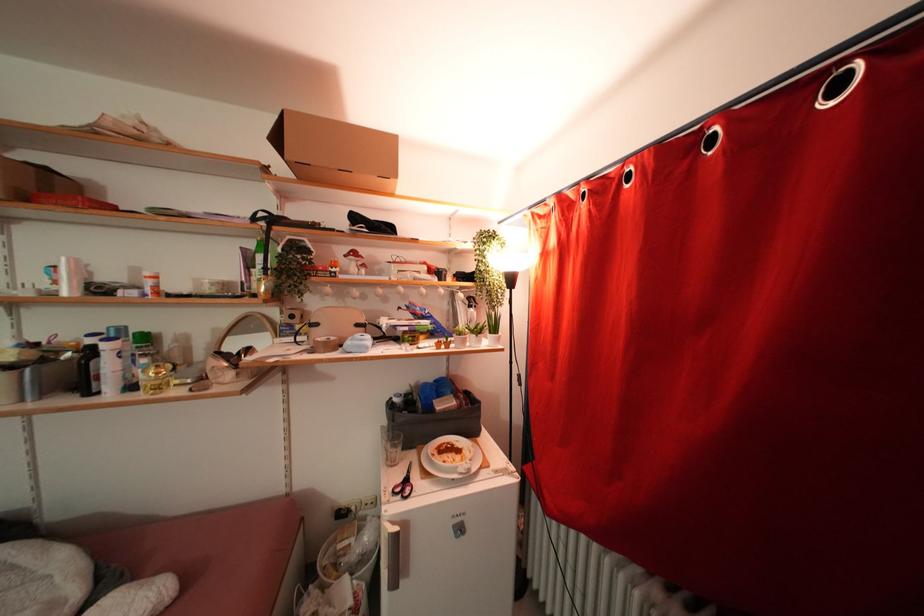
I want to click on white refrigerator handle, so click(x=391, y=554).